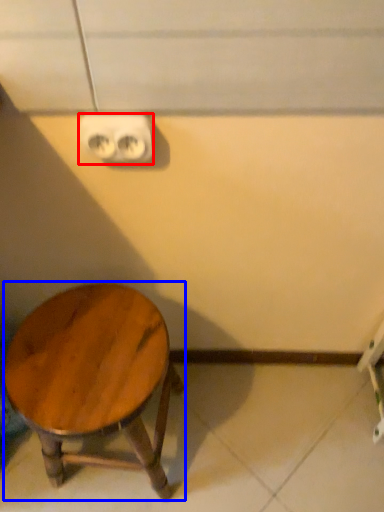
Question: Among these objects, which one is nearest to the camera, electric outlet (highlighted by a red box) or stool (highlighted by a blue box)?

Choices:
 (A) electric outlet
 (B) stool

Answer: (A)